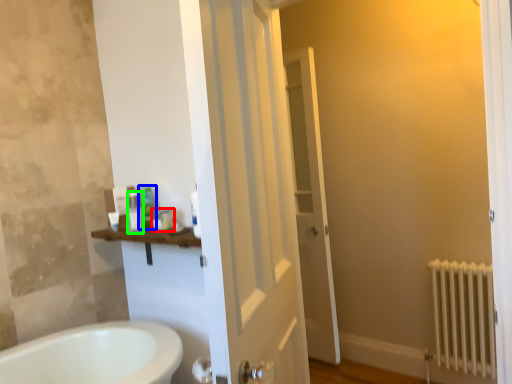
Question: Estimate the real-world distances between objects in this image. Which object is farther from toiletry (highlighted by a red box), toiletry (highlighted by a blue box) or toiletry (highlighted by a green box)?

Choices:
 (A) toiletry
 (B) toiletry

Answer: (B)